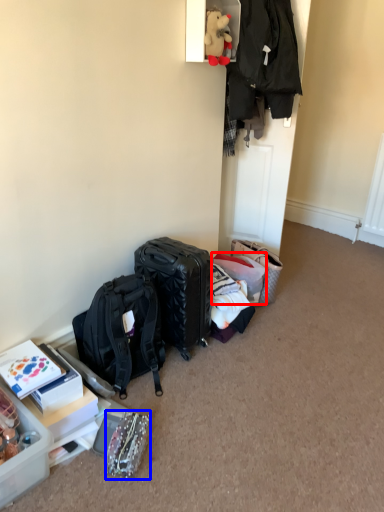
Question: Which object appears farthest to the camera in this image, suitcase (highlighted by a red box) or bag (highlighted by a blue box)?

Choices:
 (A) suitcase
 (B) bag

Answer: (A)